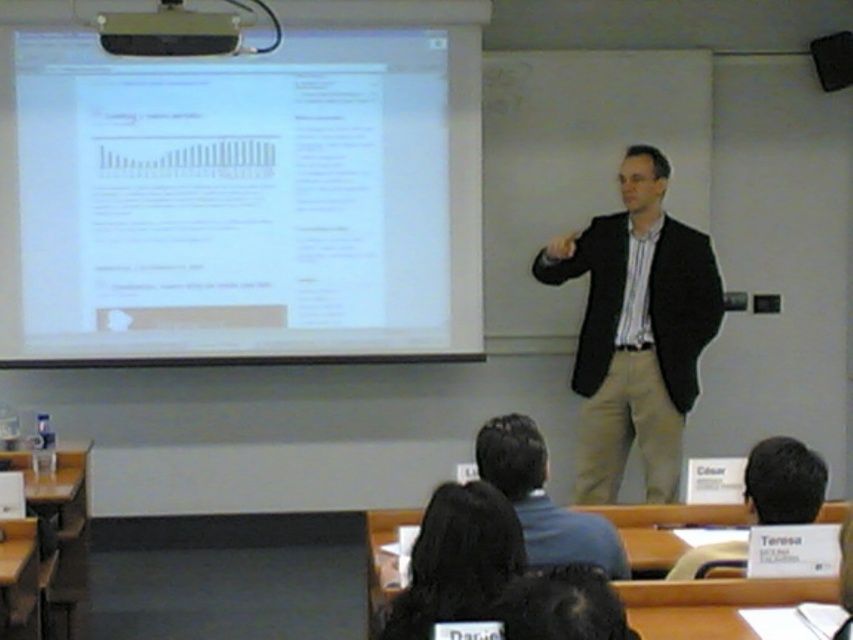
Question: Does brown hair at upper center have a greater width compared to black plastic projector at upper center?

Choices:
 (A) no
 (B) yes

Answer: (A)

Question: Can you confirm if blue shirt at center is positioned below brown hair at upper center?

Choices:
 (A) no
 (B) yes

Answer: (A)

Question: Is dark brown suit at center closer to the viewer compared to black plastic projector at upper center?

Choices:
 (A) yes
 (B) no

Answer: (B)

Question: Which of the following is the closest to the observer?

Choices:
 (A) (770, 484)
 (B) (589, 305)
 (C) (529, 538)
 (D) (840, 33)

Answer: (C)

Question: Which point is closer to the camera?

Choices:
 (A) brown hair at upper center
 (B) white paper at upper left
 (C) black plastic projector at upper center

Answer: (A)

Question: Which object is farther from the camera taking this photo?

Choices:
 (A) blue shirt at center
 (B) dark brown suit at center

Answer: (B)